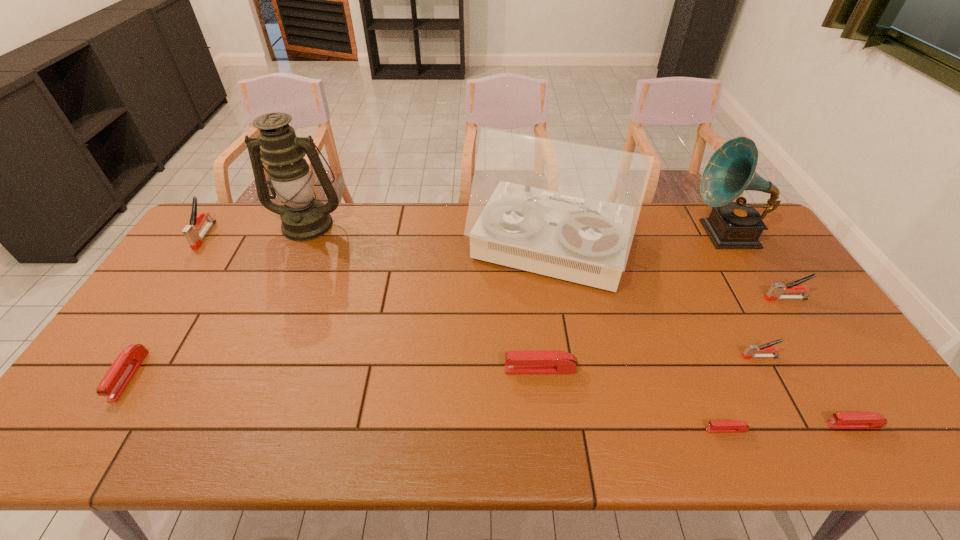
Identify the location of free space between the biggest red stapler and the fifth stapler from left to right. The image size is (960, 540). (650, 363).

The image size is (960, 540). What are the coordinates of `free space between the eighth shortest object and the second biggest gray stapler` in the screenshot? It's located at tap(756, 266).

At what (x,y) coordinates should I click in order to perform the action: click on empty location between the biggest gray stapler and the leftmost red stapler. Please return your answer as a coordinate pair (x, y). The height and width of the screenshot is (540, 960). Looking at the image, I should click on (167, 305).

Where is `blank region between the nearest gray stapler and the biggest red stapler`? This screenshot has height=540, width=960. blank region between the nearest gray stapler and the biggest red stapler is located at coordinates (650, 363).

The image size is (960, 540). Find the location of `unoccupied area between the leftmost stapler and the biggest red stapler`. unoccupied area between the leftmost stapler and the biggest red stapler is located at coordinates (372, 302).

At what (x,y) coordinates should I click in order to perform the action: click on free point between the rightmost red stapler and the white record player. Please return your answer as a coordinate pair (x, y). Looking at the image, I should click on (701, 338).

At what (x,y) coordinates should I click in order to perform the action: click on empty space between the eighth shortest object and the second stapler from left to right. Please return your answer as a coordinate pair (x, y). Looking at the image, I should click on (427, 305).

The height and width of the screenshot is (540, 960). In order to click on vacant space in between the eighth object from right to left and the record player in this screenshot , I will do `click(429, 237)`.

This screenshot has width=960, height=540. Find the location of `free space between the rightmost red stapler and the third stapler from right to left`. free space between the rightmost red stapler and the third stapler from right to left is located at coordinates (806, 390).

This screenshot has height=540, width=960. What are the coordinates of `vacant area that lies between the record player and the biggest red stapler` in the screenshot? It's located at (544, 310).